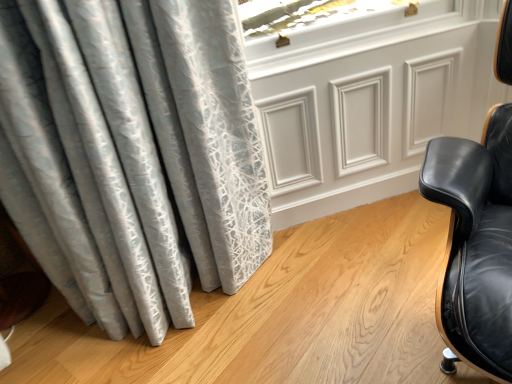
The image size is (512, 384). I want to click on black leather chair at right, so click(x=475, y=244).

Describe the element at coordinates (475, 244) in the screenshot. The width and height of the screenshot is (512, 384). I see `black leather chair at right` at that location.

In order to face black leather chair at right, should I rotate leftwards or rightwards?

A 27.507 degree turn to the right will do.

The image size is (512, 384). Describe the element at coordinates (369, 100) in the screenshot. I see `white glossy panel at upper center` at that location.

You are a GUI agent. You are given a task and a screenshot of the screen. Output one action in this format:
    pyautogui.click(x=<x>, y=<y>)
    Task: Click on the white glossy panel at upper center
    Image resolution: width=512 pixels, height=384 pixels.
    Given the screenshot: What is the action you would take?
    pyautogui.click(x=369, y=100)

Where is `black leather chair at right`? This screenshot has height=384, width=512. black leather chair at right is located at coordinates (475, 244).

Can you confirm if white glossy panel at upper center is positioned to the right of black leather chair at right?

Incorrect, white glossy panel at upper center is not on the right side of black leather chair at right.

Is the depth of white glossy panel at upper center greater than that of black leather chair at right?

Yes, white glossy panel at upper center is further from the viewer.

Which is behind, point (371, 172) or point (454, 237)?

The point (371, 172) is behind.

From the image's perspective, is white glossy panel at upper center located above or below black leather chair at right?

Clearly, from the image's perspective, white glossy panel at upper center is above black leather chair at right.

From a real-world perspective, between white glossy panel at upper center and black leather chair at right, who is vertically lower?

From a 3D spatial view, white glossy panel at upper center is below.

Considering the sizes of objects white glossy panel at upper center and black leather chair at right in the image provided, who is wider, white glossy panel at upper center or black leather chair at right?

With larger width is black leather chair at right.

Considering the sizes of objects white glossy panel at upper center and black leather chair at right in the image provided, who is shorter, white glossy panel at upper center or black leather chair at right?

With less height is white glossy panel at upper center.

Does white glossy panel at upper center have a smaller size compared to black leather chair at right?

Correct, white glossy panel at upper center occupies less space than black leather chair at right.

Is black leather chair at right completely or partially inside white glossy panel at upper center?

No, white glossy panel at upper center does not contain black leather chair at right.

Is white glossy panel at upper center not close to black leather chair at right?

No, white glossy panel at upper center is in close proximity to black leather chair at right.

Does white glossy panel at upper center turn towards black leather chair at right?

Yes, white glossy panel at upper center is aimed at black leather chair at right.

How many degrees apart are the facing directions of white glossy panel at upper center and black leather chair at right?

The angular difference between white glossy panel at upper center and black leather chair at right is 47.3 degrees.

In order to click on screen door behind the black leather chair at right in this screenshot , I will do `click(369, 100)`.

In the image, is black leather chair at right on the left side or the right side of white glossy panel at upper center?

In the image, black leather chair at right appears on the right side of white glossy panel at upper center.

Considering the positions of objects black leather chair at right and white glossy panel at upper center in the image provided, who is in front, black leather chair at right or white glossy panel at upper center?

black leather chair at right is in front.

Considering the points (480, 226) and (409, 47), which point is behind, point (480, 226) or point (409, 47)?

The point (409, 47) is more distant.

From the image's perspective, which is above, black leather chair at right or white glossy panel at upper center?

white glossy panel at upper center.

From a real-world perspective, between black leather chair at right and white glossy panel at upper center, who is vertically higher?

black leather chair at right is physically above.

Looking at their sizes, would you say black leather chair at right is wider or thinner than white glossy panel at upper center?

Considering their sizes, black leather chair at right looks broader than white glossy panel at upper center.

Can you confirm if black leather chair at right is shorter than white glossy panel at upper center?

In fact, black leather chair at right may be taller than white glossy panel at upper center.

Who is smaller, black leather chair at right or white glossy panel at upper center?

white glossy panel at upper center is smaller.

Is black leather chair at right inside or outside of white glossy panel at upper center?

black leather chair at right is not inside white glossy panel at upper center, it's outside.

Is black leather chair at right in contact with white glossy panel at upper center?

black leather chair at right and white glossy panel at upper center are not in contact.

In the scene shown: Does black leather chair at right turn towards white glossy panel at upper center?

No, black leather chair at right is not aimed at white glossy panel at upper center.

This screenshot has width=512, height=384. Find the location of `chair in front of the white glossy panel at upper center`. chair in front of the white glossy panel at upper center is located at coordinates (475, 244).

Locate an element on the screen. chair above the white glossy panel at upper center (from a real-world perspective) is located at coordinates (475, 244).

Image resolution: width=512 pixels, height=384 pixels. I want to click on screen door on the left side of black leather chair at right, so click(x=369, y=100).